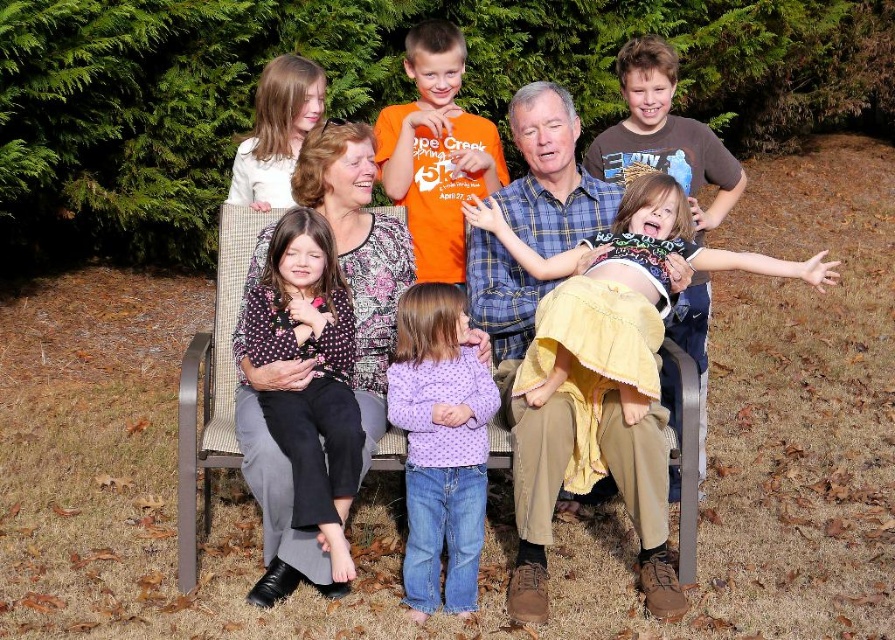
You are a photographer trying to capture a group photo of the family. You notice the plaid shirt at center and the polka dot blouse at center. Which clothing item should you focus on first if you want to ensure the larger one is in sharp focus?

The plaid shirt at center is larger than the polka dot blouse at center, so you should focus on the plaid shirt at center first to ensure it is in sharp focus.

You are a photographer trying to capture a photo of the family. You notice the orange cotton shirt at center and the yellow lace dress at right. Which clothing item should you focus on first if you want to capture the one that is higher in the image?

The orange cotton shirt at center is located above the yellow lace dress at right, so you should focus on the orange cotton shirt at center first to capture the higher positioned clothing item.

You are organizing a photo shoot and need to arrange two outfits on a mannequin. The purple dotted sweater at center and the yellow lace dress at right are the options. Based on their sizes, which one would require a larger mannequin?

The yellow lace dress at right requires a larger mannequin because its width is greater than the purple dotted sweater at center.